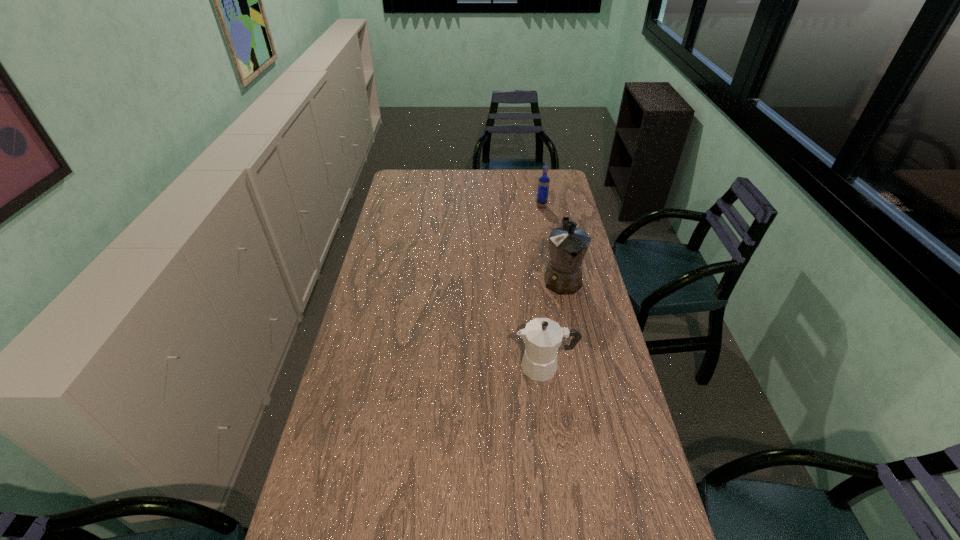
The width and height of the screenshot is (960, 540). Find the location of `vacant space that satisfies the following two spatial constraints: 1. on the pouring side of the taller coffeepot; 2. at the spout of the nearest object`. vacant space that satisfies the following two spatial constraints: 1. on the pouring side of the taller coffeepot; 2. at the spout of the nearest object is located at coordinates (580, 367).

Identify the location of vacant position in the image that satisfies the following two spatial constraints: 1. on the pouring side of the tallest object; 2. at the spout of the nearer coffeepot. [580, 367].

This screenshot has height=540, width=960. In order to click on vacant position in the image that satisfies the following two spatial constraints: 1. on the pouring side of the tallest object; 2. at the spout of the nearer coffeepot in this screenshot , I will do `click(580, 367)`.

Locate an element on the screen. Image resolution: width=960 pixels, height=540 pixels. vacant area in the image that satisfies the following two spatial constraints: 1. on the pouring side of the tallest object; 2. at the spout of the nearest object is located at coordinates (580, 367).